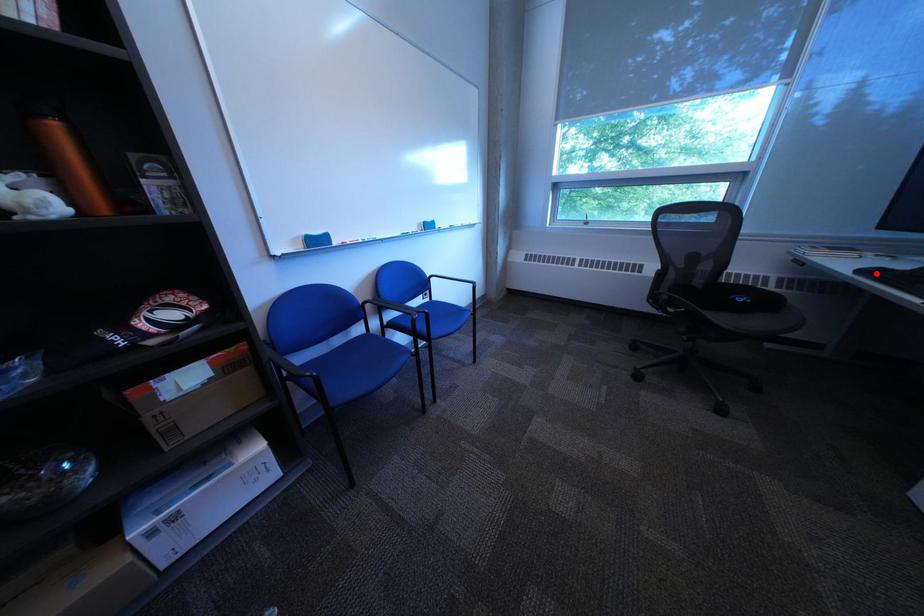
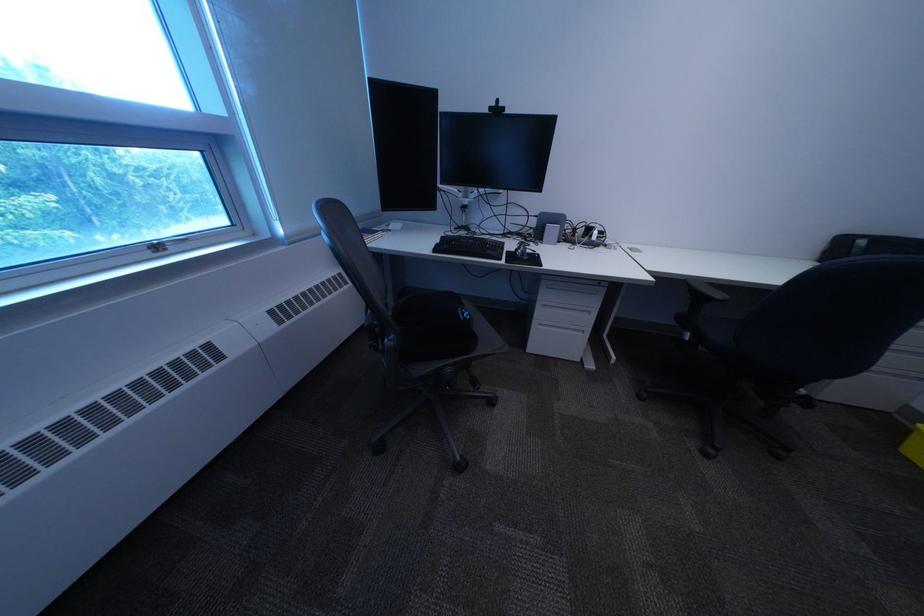
Locate, in the second image, the point that corresponds to the highlighted location in the first image.

(451, 252)